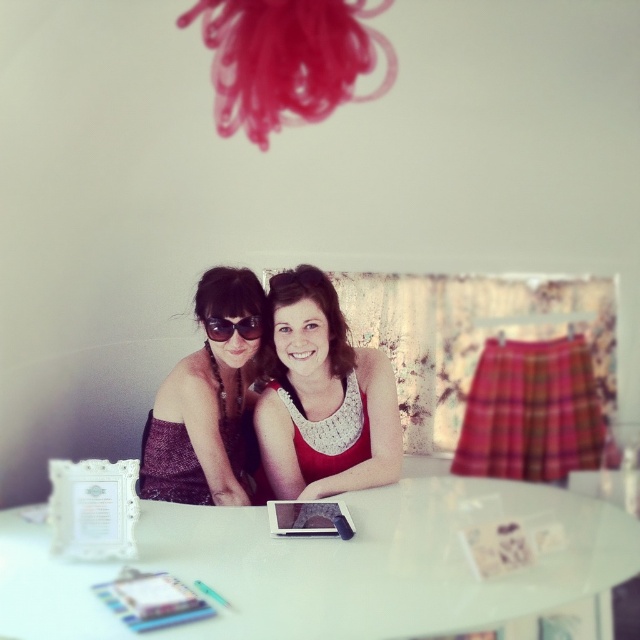
Does white glossy round table at center have a lesser height compared to matte black dress at center?

Yes, white glossy round table at center is shorter than matte black dress at center.

Does white glossy round table at center have a lesser width compared to matte black dress at center?

No.

Describe the element at coordinates (385, 561) in the screenshot. This screenshot has width=640, height=640. I see `white glossy round table at center` at that location.

Locate an element on the screen. This screenshot has height=640, width=640. white glossy round table at center is located at coordinates (385, 561).

In the scene shown: Between white lace tank top at center and matte black sunglasses at center, which one has less height?

matte black sunglasses at center

Does white lace tank top at center appear on the left side of matte black sunglasses at center?

No, white lace tank top at center is not to the left of matte black sunglasses at center.

Between point (296, 474) and point (218, 317), which one is positioned in front?

Point (218, 317)

Find the location of `white lace tank top at center`. white lace tank top at center is located at coordinates (321, 397).

Between point (26, 595) and point (218, 321), which one is positioned in front?

Positioned in front is point (26, 595).

Can you confirm if white glossy round table at center is taller than matte black sunglasses at center?

Yes, white glossy round table at center is taller than matte black sunglasses at center.

Is point (564, 573) farther from camera compared to point (236, 328)?

No, it is in front of (236, 328).

I want to click on white glossy round table at center, so click(385, 561).